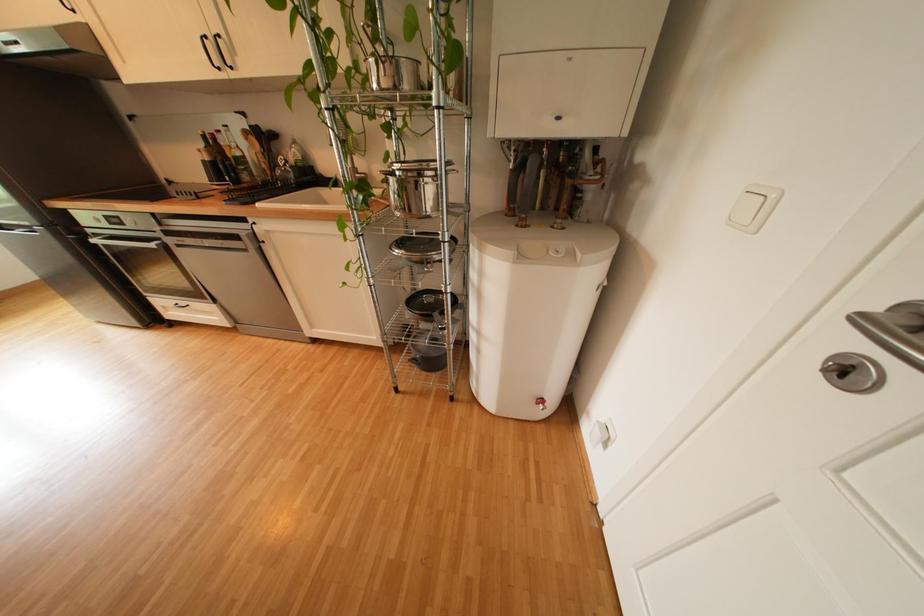
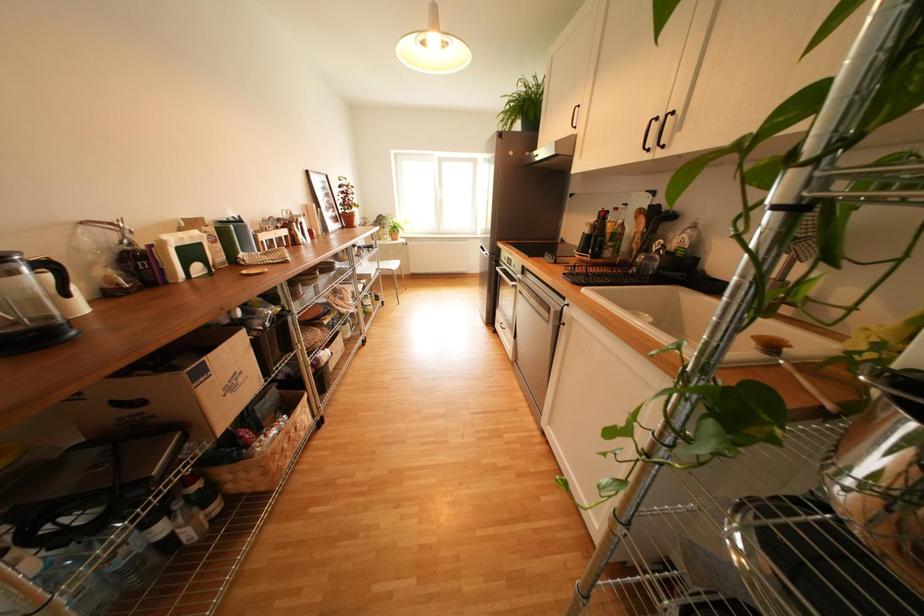
Question: The images are taken continuously from a first-person perspective. In which direction is your viewpoint rotating?

Choices:
 (A) Left
 (B) Right
 (C) Up
 (D) Down

Answer: (A)